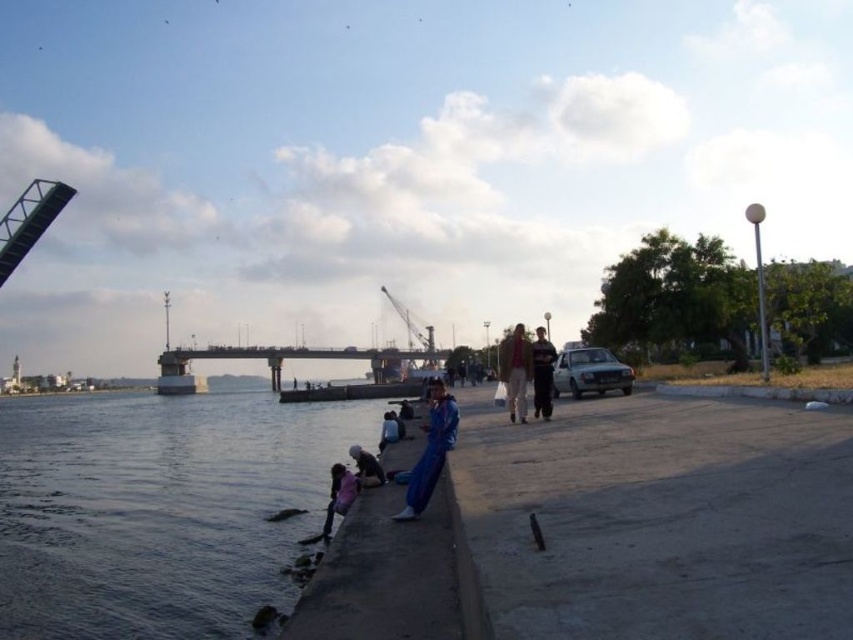
You are a photographer standing at the dark blue fabric jacket at center position. You want to take a photo of the pink fabric child at lower left without moving. Is the child within your camera lens range of 50 feet?

The distance between dark blue fabric jacket at center and pink fabric child at lower left is 54.16 feet, which exceeds the camera lens range of 50 feet. Therefore, the child is out of range.

You are standing on the dark gray concrete river at lower left and want to reach the light blue fabric at lower center. Which direction should you move to get closer to it?

The dark gray concrete river at lower left is closer to the viewer than the light blue fabric at lower center, so to reach the light blue fabric at lower center, you should move forward away from the viewer towards it.